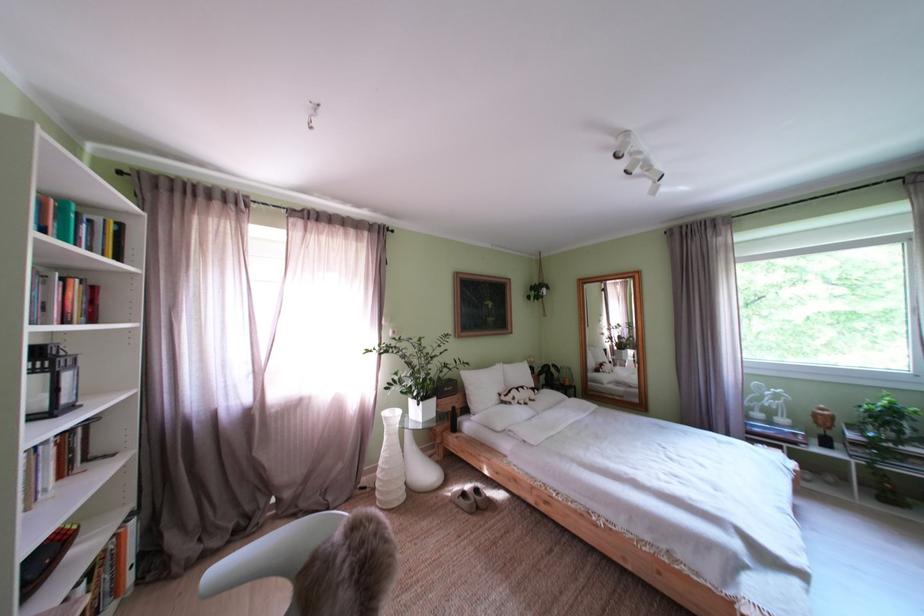
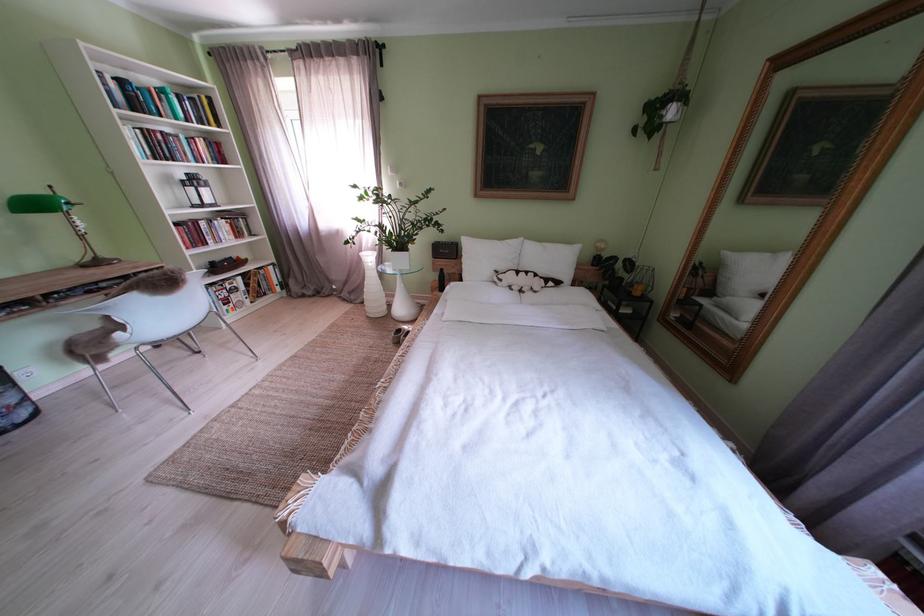
Locate, in the second image, the point that corresponds to the point at 342,505 in the first image.

(363, 302)